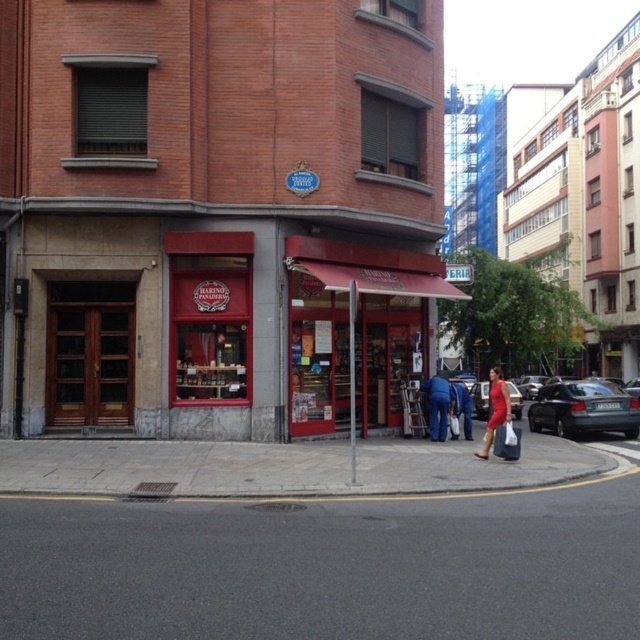
You are standing on the sidewalk in front of the red brick building. You see the red matte awning at center and the metallic silver car at center. Which object is closer to you?

The red matte awning at center is closer to you because it is further to the viewer than the metallic silver car at center.

You are a delivery driver who needs to park your metallic silver car at center near the red matte awning at center. Based on the scene, can you park your car so that it is directly in front of the awning?

The red matte awning at center is positioned on the left side of the metallic silver car at center, so the car is already parked to the right of the awning. Since the awning is part of the building, you can park the car directly in front of it as long as there is space on the street.